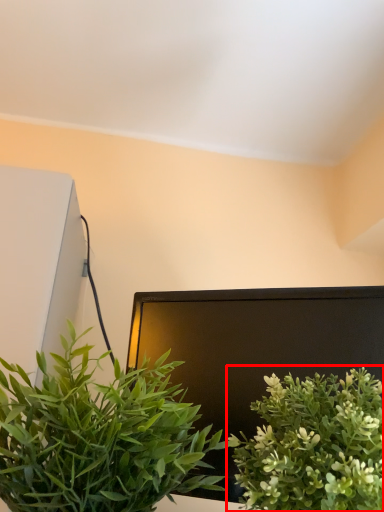
Question: In this image, where is houseplant (annotated by the red box) located relative to houseplant?

Choices:
 (A) left
 (B) right

Answer: (B)